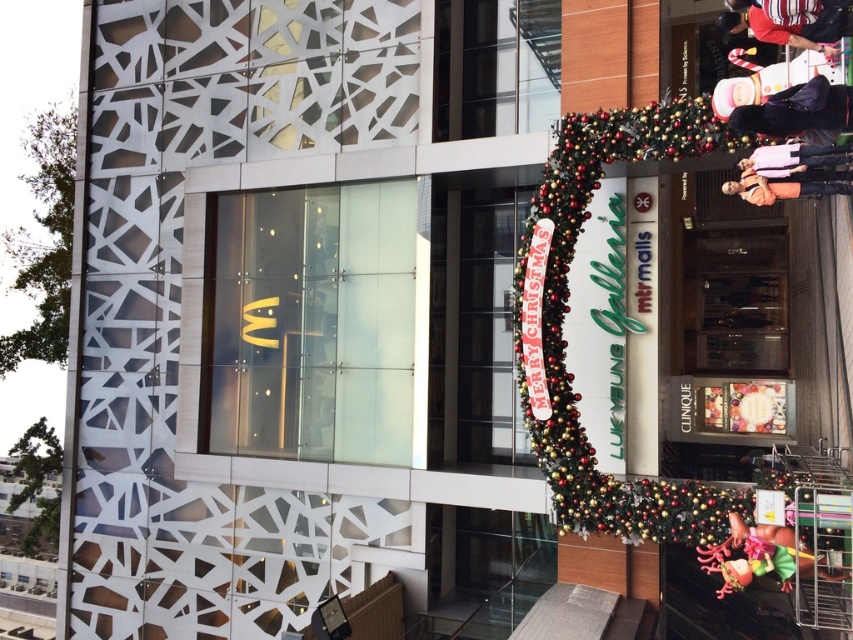
Looking at this image, you are a window cleaner standing at the lower part of the building. You need to clean the dark blue jacket at upper right and the white fabric at upper right. Which one should you clean first if you start from the bottom and move upwards?

You should clean the white fabric at upper right first because the dark blue jacket at upper right is above it, so you would reach the lower one first when moving upward.

You are a window cleaner standing on the ground floor of the building. You need to clean the glass window with the McDonald logo. However, there are two obstacles at the upper right corner of the building. What is the position of the dark blue jacket at upper right relative to the white fabric at upper right?

The dark blue jacket at upper right is positioned to the left of the white fabric at upper right, so you should first remove the dark blue jacket at upper right before reaching the white fabric at upper right to clean the McDonald logo window.

You are an event planner setting up decorations for a Christmas event. You need to determine if the gold metallic garland at center right can be hung higher than the white fabric at upper right. Based on the scene, can you confirm this?

The gold metallic garland at center right is much taller than the white fabric at upper right, so yes, it can be hung higher than the white fabric at upper right.